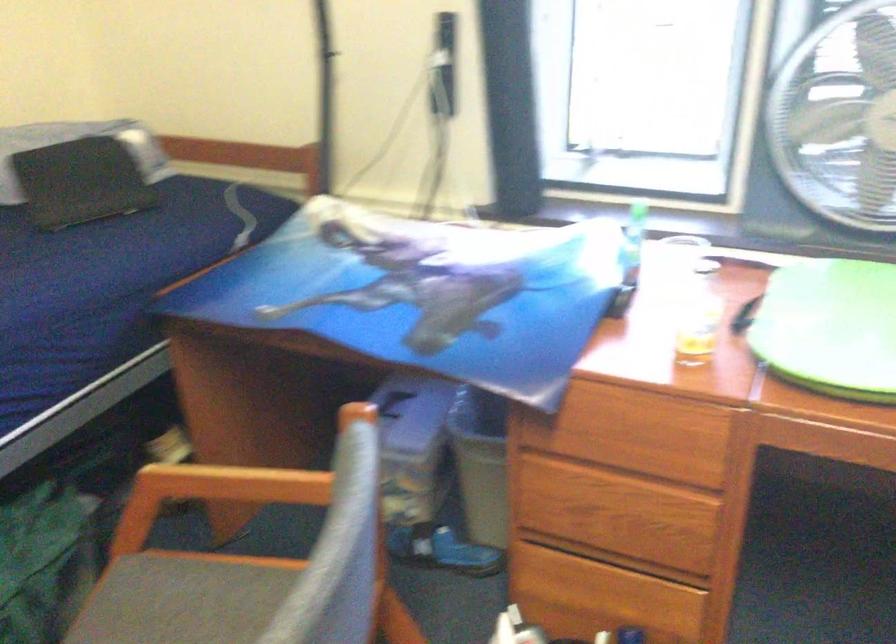
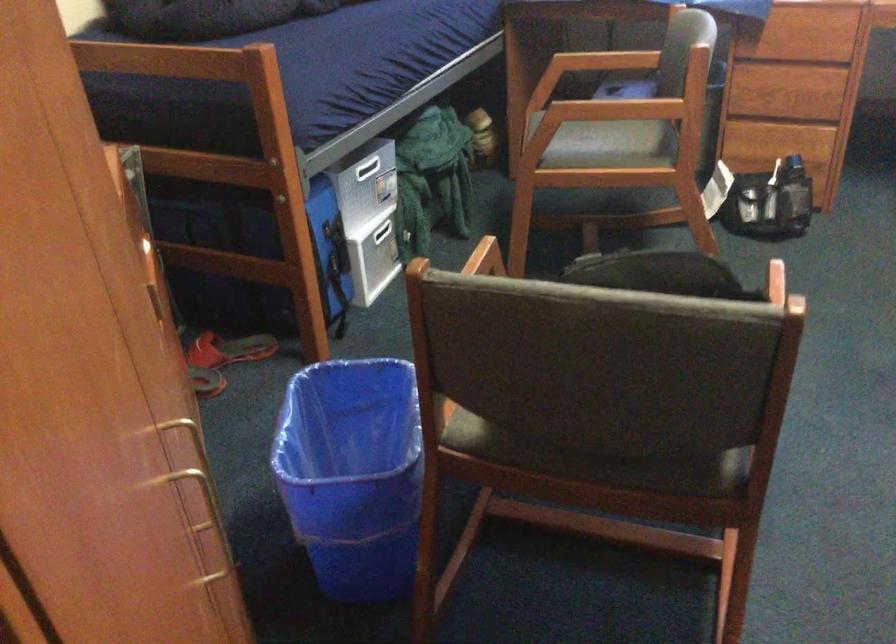
The images are taken continuously from a first-person perspective. In which direction are you moving?

The movement direction of the cameraman is left, backward.